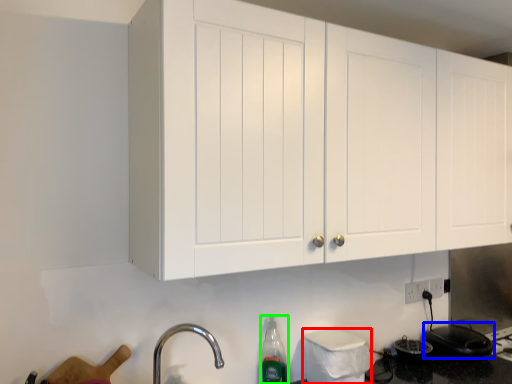
Question: Which object is positioned closest to appliance (highlighted by a red box)? Select from appliance (highlighted by a blue box) and bottle (highlighted by a green box).

Choices:
 (A) appliance
 (B) bottle

Answer: (B)